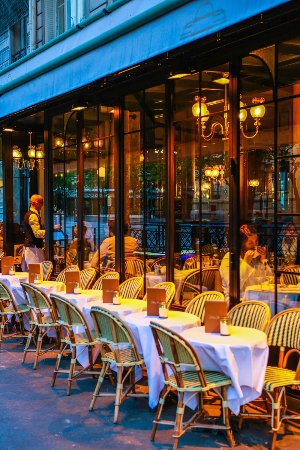
You are a GUI agent. You are given a task and a screenshot of the screen. Output one action in this format:
    pyautogui.click(x=<x>, y=<y>)
    Task: Click on the candles
    
    Given the screenshot: What is the action you would take?
    pyautogui.click(x=226, y=327), pyautogui.click(x=163, y=310), pyautogui.click(x=116, y=297), pyautogui.click(x=75, y=283), pyautogui.click(x=35, y=276), pyautogui.click(x=11, y=267)